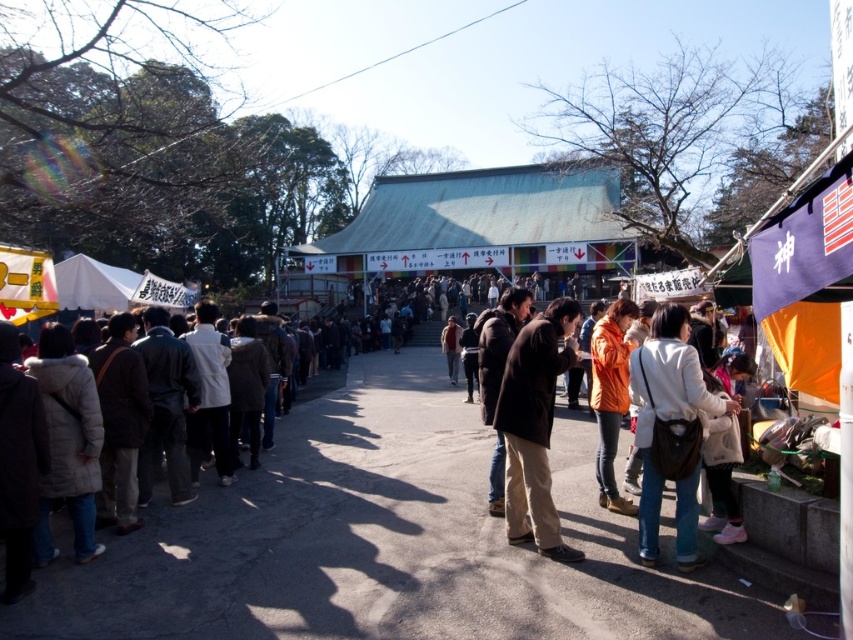
Is light beige leather jacket at lower right positioned at the back of orange matte jacket at center?

No, light beige leather jacket at lower right is in front of orange matte jacket at center.

Is light beige leather jacket at lower right positioned before orange matte jacket at center?

Yes, light beige leather jacket at lower right is closer to the viewer.

The image size is (853, 640). Describe the element at coordinates (670, 429) in the screenshot. I see `light beige leather jacket at lower right` at that location.

This screenshot has height=640, width=853. In order to click on light beige leather jacket at lower right in this screenshot , I will do `click(670, 429)`.

Between light beige leather jacket at lower right and dark brown leather jacket at center, which one is positioned lower?

dark brown leather jacket at center is below.

Is light beige leather jacket at lower right to the right of dark brown leather jacket at center from the viewer's perspective?

Indeed, light beige leather jacket at lower right is positioned on the right side of dark brown leather jacket at center.

Which is behind, point (631, 352) or point (532, 321)?

The point (532, 321) is behind.

In order to click on light beige leather jacket at lower right in this screenshot , I will do `click(670, 429)`.

Is point (508, 426) positioned before point (612, 328)?

Yes, point (508, 426) is closer to viewer.

Does point (569, 362) come farther from viewer compared to point (599, 317)?

No.

Measure the distance between dark brown leather jacket at center and camera.

dark brown leather jacket at center and camera are 4.86 meters apart.

This screenshot has height=640, width=853. Find the location of `dark brown leather jacket at center`. dark brown leather jacket at center is located at coordinates 534,426.